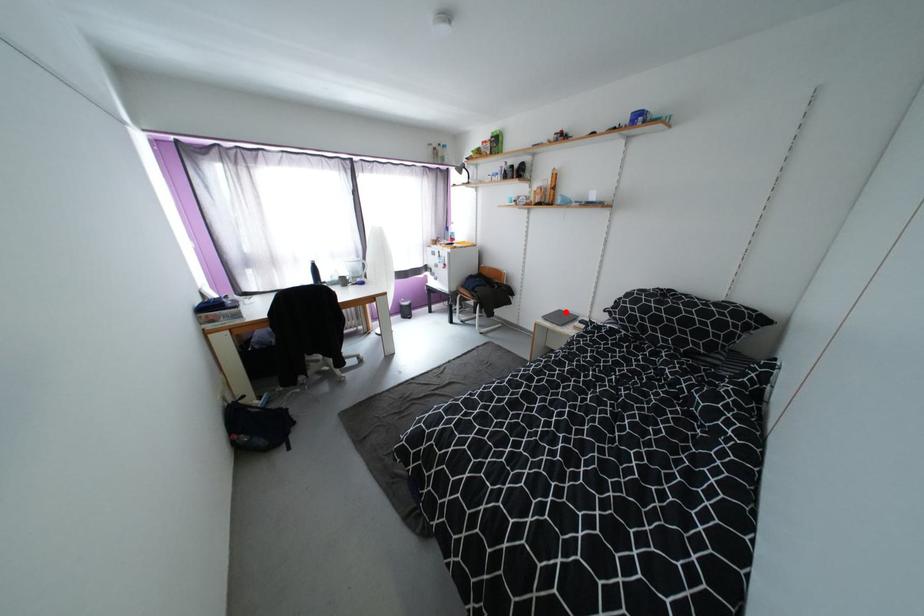
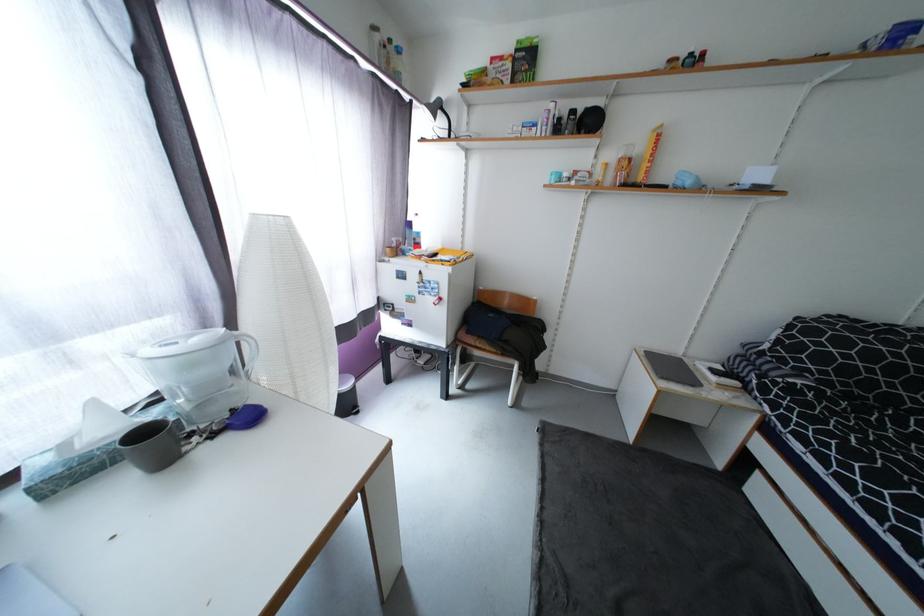
Find the pixel in the second image that matches the highlighted location in the first image.

(650, 353)